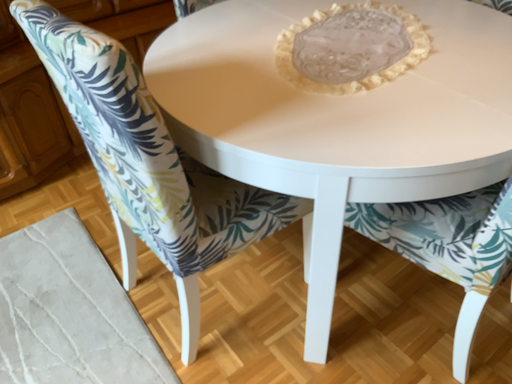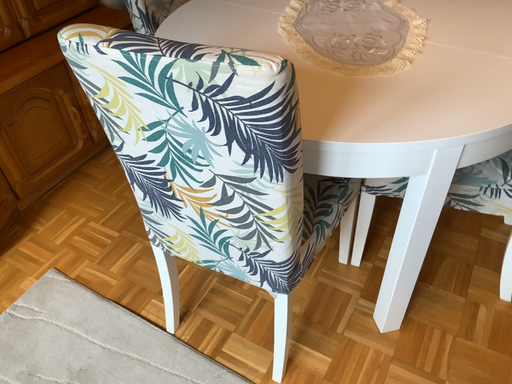
Question: Which way did the camera rotate in the video?

Choices:
 (A) rotated left
 (B) rotated right

Answer: (B)